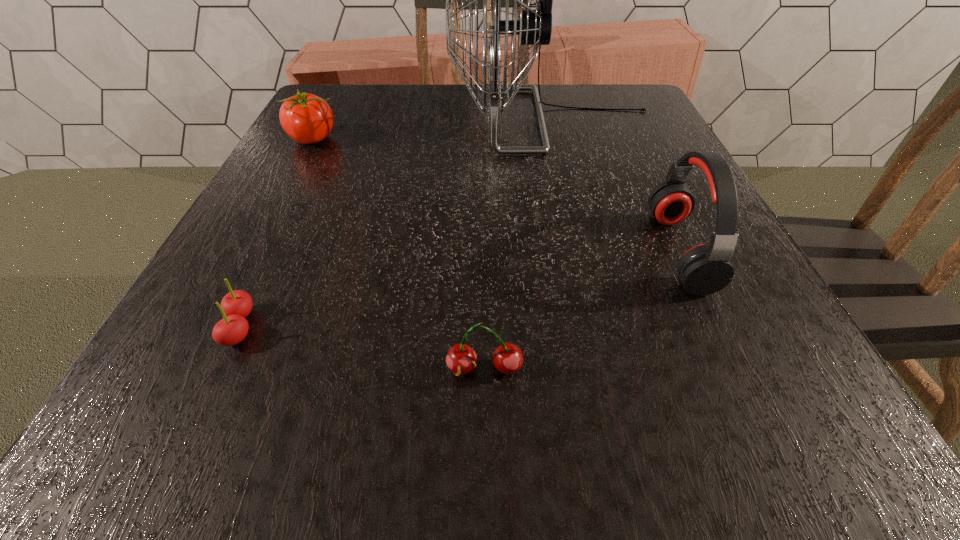
The width and height of the screenshot is (960, 540). In order to click on the second closest object to the fourth shortest object in this screenshot , I will do `click(461, 359)`.

The image size is (960, 540). I want to click on object that is the fourth closest to the tomato, so click(x=705, y=269).

The width and height of the screenshot is (960, 540). Identify the location of vacant area that satisfies the following two spatial constraints: 1. on the front-facing side of the tallest object; 2. on the front side of the tomato. (556, 139).

The width and height of the screenshot is (960, 540). I want to click on vacant point that satisfies the following two spatial constraints: 1. on the ear cups of the earphone; 2. with stems pointing upwards on the right cherry, so click(x=733, y=369).

Image resolution: width=960 pixels, height=540 pixels. I want to click on free space that satisfies the following two spatial constraints: 1. on the front-facing side of the fan; 2. with stems pointing upwards on the right cherry, so click(x=611, y=369).